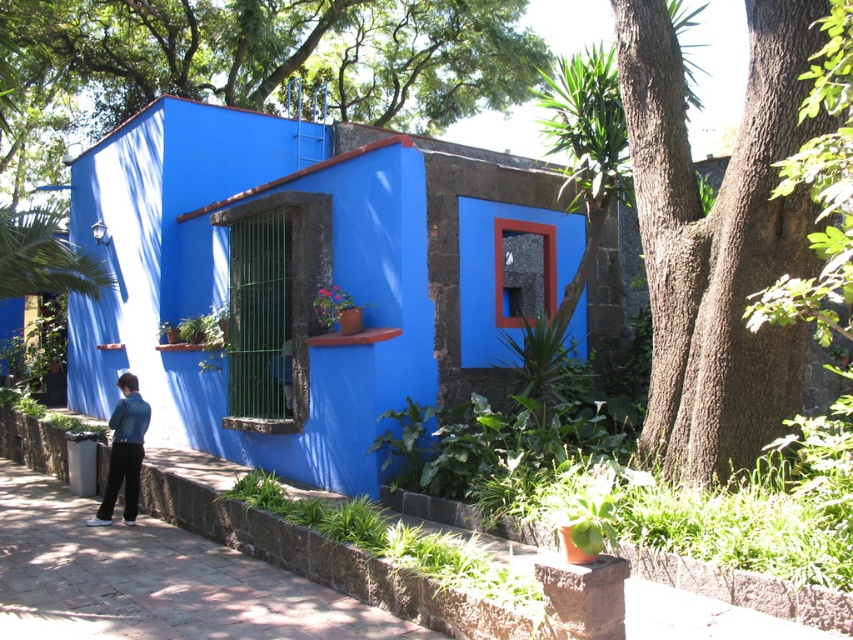
In the scene shown: Is green leafy tree at upper center smaller than brown rough bark tree at right?

Actually, green leafy tree at upper center might be larger than brown rough bark tree at right.

At what (x,y) coordinates should I click in order to perform the action: click on green leafy tree at upper center. Please return your answer as a coordinate pair (x, y). The image size is (853, 640). Looking at the image, I should click on (254, 61).

Is brown rough bark tree at right to the left of denim jacket at lower left from the viewer's perspective?

In fact, brown rough bark tree at right is to the right of denim jacket at lower left.

This screenshot has height=640, width=853. Describe the element at coordinates (718, 237) in the screenshot. I see `brown rough bark tree at right` at that location.

Where is `brown rough bark tree at right`? The image size is (853, 640). brown rough bark tree at right is located at coordinates (718, 237).

Does green leafy tree at upper center have a smaller size compared to denim jacket at lower left?

No.

From the picture: Between green leafy tree at upper center and denim jacket at lower left, which one appears on the right side from the viewer's perspective?

denim jacket at lower left

Is point (341, 1) positioned in front of point (115, 412)?

No, it is not.

Image resolution: width=853 pixels, height=640 pixels. I want to click on green leafy tree at upper center, so click(x=254, y=61).